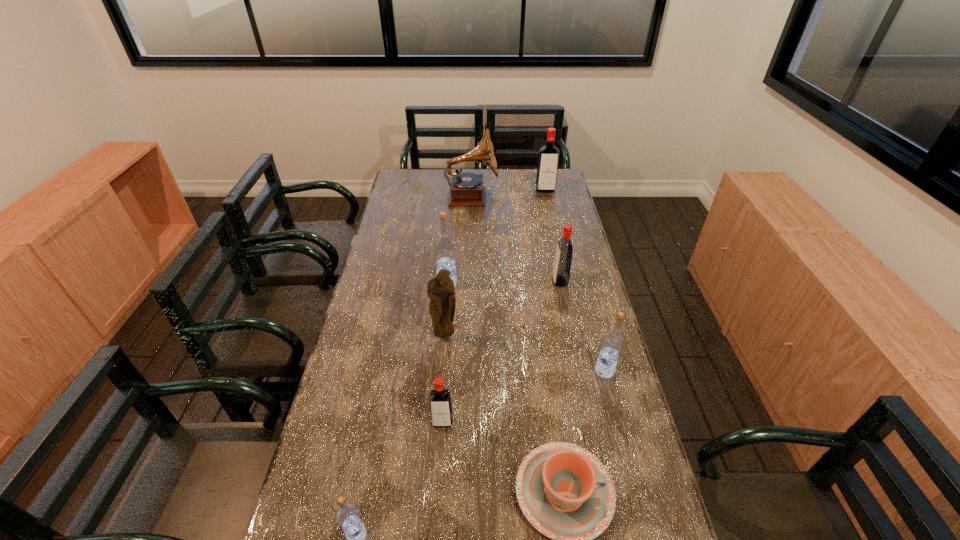
At what (x,y) coordinates should I click in order to perform the action: click on unoccupied position between the second farthest red vodka and the fifth nearest object. Please return your answer as a coordinate pair (x, y). Looking at the image, I should click on (502, 309).

At what (x,y) coordinates should I click in order to perform the action: click on object that stands as the sixth closest to the second farthest blue vodka. Please return your answer as a coordinate pair (x, y). Looking at the image, I should click on (348, 517).

Find the location of a particular element. Image resolution: width=960 pixels, height=540 pixels. object that ranks as the third closest to the phonograph_record is located at coordinates (562, 264).

Identify which vodka is located as the third nearest to the farthest blue vodka. Please provide its 2D coordinates. Your answer should be formatted as a tuple, i.e. [(x, y)], where the tuple contains the x and y coordinates of a point satisfying the conditions above.

[(613, 340)]

Identify the location of vodka that is the third closest to the second biggest red vodka. tap(548, 158).

Identify the location of red vodka that is the third closest to the sixth farthest object. The width and height of the screenshot is (960, 540). (548, 158).

Image resolution: width=960 pixels, height=540 pixels. Identify the location of red vodka that stands as the second closest to the nearest vodka. (562, 264).

Choose which blue vodka is the second nearest neighbor to the smallest red vodka. Please provide its 2D coordinates. Your answer should be formatted as a tuple, i.e. [(x, y)], where the tuple contains the x and y coordinates of a point satisfying the conditions above.

[(613, 340)]

At what (x,y) coordinates should I click in order to perform the action: click on blue vodka that can be found as the third closest to the nearest red vodka. Please return your answer as a coordinate pair (x, y). The image size is (960, 540). Looking at the image, I should click on (444, 245).

Where is `vacant space that satisfies the following two spatial constraints: 1. on the front and back of the second nearest red vodka; 2. on the right side of the third nearest vodka`? This screenshot has width=960, height=540. vacant space that satisfies the following two spatial constraints: 1. on the front and back of the second nearest red vodka; 2. on the right side of the third nearest vodka is located at coordinates (578, 371).